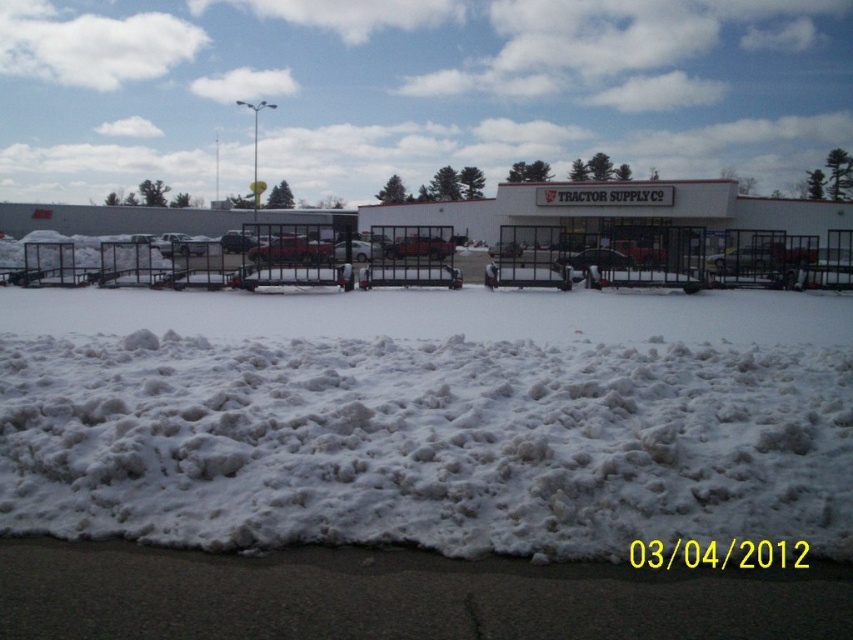
Question: Does white fluffy snow at lower center come behind matte red truck at center?

Choices:
 (A) yes
 (B) no

Answer: (B)

Question: Is white fluffy snow at lower center above metallic silver sedan at center?

Choices:
 (A) yes
 (B) no

Answer: (B)

Question: Which object appears farthest from the camera in this image?

Choices:
 (A) white fluffy snow at lower center
 (B) matte red truck at center
 (C) metallic silver sedan at center

Answer: (B)

Question: Can you confirm if white fluffy snow at lower center is bigger than matte red truck at center?

Choices:
 (A) yes
 (B) no

Answer: (B)

Question: Among these objects, which one is farthest from the camera?

Choices:
 (A) matte red truck at center
 (B) metallic silver sedan at center
 (C) white fluffy snow at lower center

Answer: (A)

Question: Which object appears closest to the camera in this image?

Choices:
 (A) metallic silver sedan at center
 (B) matte red truck at center

Answer: (A)